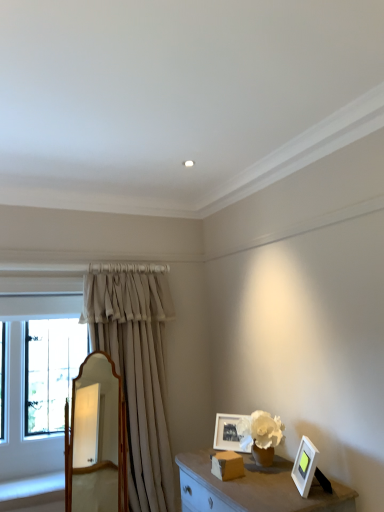
Measure the distance between point [298,490] and camera.

2.30 meters.

Locate an element on the screen. This screenshot has height=512, width=384. wooden mirror at center is located at coordinates (98, 442).

What do you see at coordinates (98, 442) in the screenshot?
I see `wooden mirror at center` at bounding box center [98, 442].

Identify the location of beige fabric curtain at left. This screenshot has height=512, width=384. (136, 368).

From the picture: Which object is positioned more to the left, wooden mirror at center or matte white picture frame at center, arranged as the 2th picture frame when viewed from the right?

Positioned to the left is wooden mirror at center.

How many degrees apart are the facing directions of wooden mirror at center and matte white picture frame at center, the first picture frame in the left-to-right sequence?

There is a 29.7-degree angle between the facing directions of wooden mirror at center and matte white picture frame at center, the first picture frame in the left-to-right sequence.

Considering the positions of points (104, 385) and (247, 451), is point (104, 385) closer to camera compared to point (247, 451)?

No, it is not.

Is wooden mirror at center shorter than matte white picture frame at center, placed as the 1th picture frame when sorted from back to front?

No, wooden mirror at center is not shorter than matte white picture frame at center, placed as the 1th picture frame when sorted from back to front.

Can you confirm if beige fabric curtain at left is smaller than wooden mirror at center?

No.

Between beige fabric curtain at left and wooden mirror at center, which one has smaller width?

Thinner between the two is wooden mirror at center.

From a real-world perspective, which is physically above, beige fabric curtain at left or wooden mirror at center?

From a 3D spatial view, beige fabric curtain at left is above.

Could you tell me if beige fabric curtain at left is turned towards wooden mirror at center?

No, beige fabric curtain at left is not turned towards wooden mirror at center.

Is wooden mirror at center further to the viewer compared to beige fabric curtain at left?

No.

Is wooden mirror at center to the right of beige fabric curtain at left from the viewer's perspective?

No.

From the image's perspective, is wooden mirror at center under beige fabric curtain at left?

Yes, from the image's perspective, wooden mirror at center is below beige fabric curtain at left.

Is matte white picture frame at center, the first picture frame in the left-to-right sequence, looking in the opposite direction of beige fabric curtain at left?

No, beige fabric curtain at left is not at the back of matte white picture frame at center, the first picture frame in the left-to-right sequence.

Is matte white picture frame at center, placed as the 1th picture frame when sorted from back to front, not near beige fabric curtain at left?

No.

In the scene shown: Does matte white picture frame at center, marked as the 2th picture frame in a front-to-back arrangement, have a greater width compared to beige fabric curtain at left?

No.

From a real-world perspective, who is located lower, wooden mirror at center or white matte picture frame at lower right, the 1th picture frame in the right-to-left sequence?

white matte picture frame at lower right, the 1th picture frame in the right-to-left sequence, is physically lower.

Could you tell me if wooden mirror at center is turned towards white matte picture frame at lower right, the 1th picture frame in the right-to-left sequence?

No, wooden mirror at center is not aimed at white matte picture frame at lower right, the 1th picture frame in the right-to-left sequence.

Considering the relative sizes of wooden mirror at center and white matte picture frame at lower right, the 1th picture frame from the front, in the image provided, is wooden mirror at center shorter than white matte picture frame at lower right, the 1th picture frame from the front,?

Incorrect, the height of wooden mirror at center does not fall short of that of white matte picture frame at lower right, the 1th picture frame from the front.

What are the coordinates of `the 2nd picture frame counting from the right side of the wooden mirror at center` in the screenshot? It's located at (305, 466).

Can we say white matte picture frame at lower right, arranged as the second picture frame when viewed from the back, lies outside matte white picture frame at center, arranged as the 2th picture frame when viewed from the right?

Yes, white matte picture frame at lower right, arranged as the second picture frame when viewed from the back, is located beyond the bounds of matte white picture frame at center, arranged as the 2th picture frame when viewed from the right.

Is white matte picture frame at lower right, the 1th picture frame from the front, wider or thinner than matte white picture frame at center, marked as the 2th picture frame in a front-to-back arrangement?

Considering their sizes, white matte picture frame at lower right, the 1th picture frame from the front, looks broader than matte white picture frame at center, marked as the 2th picture frame in a front-to-back arrangement.

From the image's perspective, is white matte picture frame at lower right, which appears as the second picture frame when viewed from the left, located above or below matte white picture frame at center, arranged as the 2th picture frame when viewed from the right?

white matte picture frame at lower right, which appears as the second picture frame when viewed from the left, is above matte white picture frame at center, arranged as the 2th picture frame when viewed from the right.

From the picture: From their relative heights in the image, would you say white matte picture frame at lower right, the 1th picture frame from the front, is taller or shorter than matte white picture frame at center, marked as the 2th picture frame in a front-to-back arrangement?

Clearly, white matte picture frame at lower right, the 1th picture frame from the front, is taller compared to matte white picture frame at center, marked as the 2th picture frame in a front-to-back arrangement.

Visually, is beige fabric curtain at left positioned to the left or to the right of matte white picture frame at center, marked as the 2th picture frame in a front-to-back arrangement?

From the image, it's evident that beige fabric curtain at left is to the left of matte white picture frame at center, marked as the 2th picture frame in a front-to-back arrangement.

Considering the relative sizes of beige fabric curtain at left and matte white picture frame at center, placed as the 1th picture frame when sorted from back to front, in the image provided, is beige fabric curtain at left wider than matte white picture frame at center, placed as the 1th picture frame when sorted from back to front,?

Indeed, beige fabric curtain at left has a greater width compared to matte white picture frame at center, placed as the 1th picture frame when sorted from back to front.

Is beige fabric curtain at left beside matte white picture frame at center, placed as the 1th picture frame when sorted from back to front?

beige fabric curtain at left is not next to matte white picture frame at center, placed as the 1th picture frame when sorted from back to front, and they're not touching.

How many degrees apart are the facing directions of beige fabric curtain at left and matte white picture frame at center, placed as the 1th picture frame when sorted from back to front?

There is a 34.8-degree angle between the facing directions of beige fabric curtain at left and matte white picture frame at center, placed as the 1th picture frame when sorted from back to front.

Locate an element on the screen. picture frame located behind the wooden mirror at center is located at coordinates (227, 433).

Find the location of `curtain that is above the wooden mirror at center (from the image's perspective)`. curtain that is above the wooden mirror at center (from the image's perspective) is located at coordinates (136, 368).

Estimate the real-world distances between objects in this image. Which object is further from wooden mirror at center, matte white picture frame at center, placed as the 1th picture frame when sorted from back to front, or beige fabric curtain at left?

The object further to wooden mirror at center is matte white picture frame at center, placed as the 1th picture frame when sorted from back to front.

Based on their spatial positions, is matte white picture frame at center, arranged as the 2th picture frame when viewed from the right, or wooden mirror at center closer to white matte picture frame at lower right, arranged as the second picture frame when viewed from the back?

The object closer to white matte picture frame at lower right, arranged as the second picture frame when viewed from the back, is matte white picture frame at center, arranged as the 2th picture frame when viewed from the right.

Looking at the image, which one is located closer to wooden mirror at center, beige fabric curtain at left or white matte picture frame at lower right, the 1th picture frame from the front?

beige fabric curtain at left.

When comparing their distances from matte white picture frame at center, placed as the 1th picture frame when sorted from back to front, does beige fabric curtain at left or wooden mirror at center seem closer?

beige fabric curtain at left lies closer to matte white picture frame at center, placed as the 1th picture frame when sorted from back to front, than the other object.

When comparing their distances from beige fabric curtain at left, does matte white picture frame at center, placed as the 1th picture frame when sorted from back to front, or wooden mirror at center seem further?

The object further to beige fabric curtain at left is matte white picture frame at center, placed as the 1th picture frame when sorted from back to front.

From the image, which object appears to be farther from matte white picture frame at center, arranged as the 2th picture frame when viewed from the right, wooden mirror at center or white matte picture frame at lower right, which appears as the second picture frame when viewed from the left?

wooden mirror at center lies further to matte white picture frame at center, arranged as the 2th picture frame when viewed from the right, than the other object.

From the image, which object appears to be nearer to matte white picture frame at center, the first picture frame in the left-to-right sequence, wooden mirror at center or beige fabric curtain at left?

Based on the image, beige fabric curtain at left appears to be nearer to matte white picture frame at center, the first picture frame in the left-to-right sequence.

Considering their positions, is white matte picture frame at lower right, which appears as the second picture frame when viewed from the left, positioned closer to wooden mirror at center than matte white picture frame at center, the first picture frame in the left-to-right sequence?

matte white picture frame at center, the first picture frame in the left-to-right sequence.

This screenshot has width=384, height=512. What are the coordinates of `curtain situated between wooden mirror at center and matte white picture frame at center, marked as the 2th picture frame in a front-to-back arrangement, from left to right` in the screenshot? It's located at (136, 368).

I want to click on picture frame between wooden mirror at center and white matte picture frame at lower right, the 1th picture frame from the front, in the horizontal direction, so click(x=227, y=433).

The width and height of the screenshot is (384, 512). What are the coordinates of `curtain between wooden mirror at center and white matte picture frame at lower right, arranged as the second picture frame when viewed from the back` in the screenshot? It's located at (136, 368).

The height and width of the screenshot is (512, 384). What are the coordinates of `picture frame between beige fabric curtain at left and white matte picture frame at lower right, the 1th picture frame in the right-to-left sequence, in the horizontal direction` in the screenshot? It's located at (227, 433).